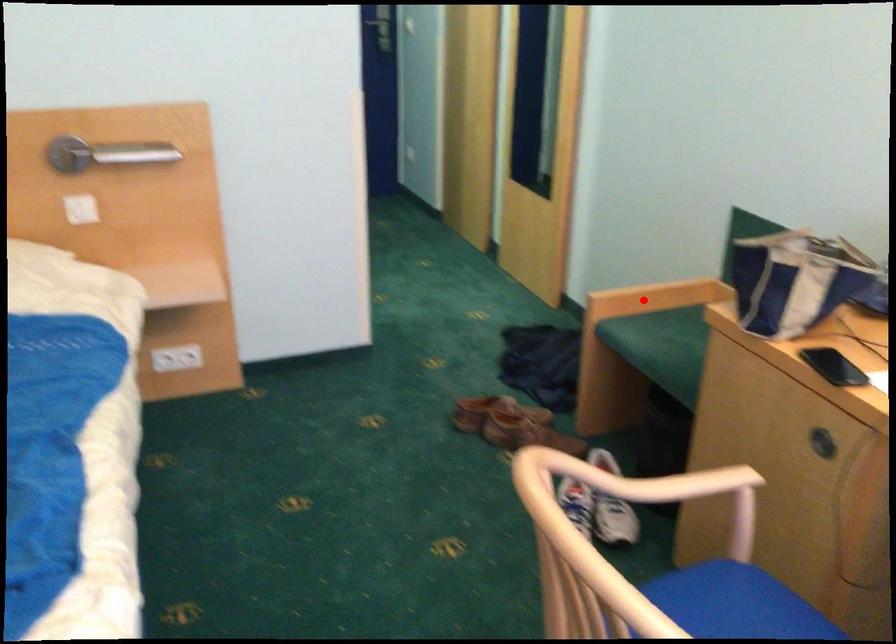
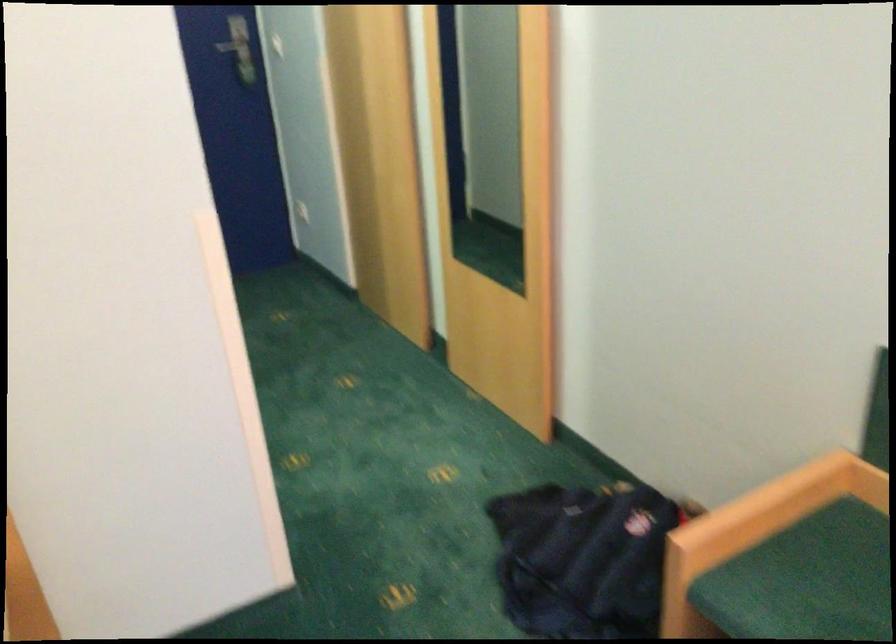
Find the pixel in the second image that matches the highlighted location in the first image.

(756, 529)